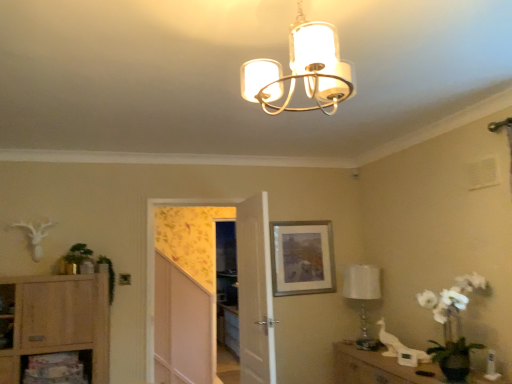
Locate an element on the screen. The width and height of the screenshot is (512, 384). free space above silver/metallic picture frame at center (from a real-world perspective) is located at coordinates (301, 216).